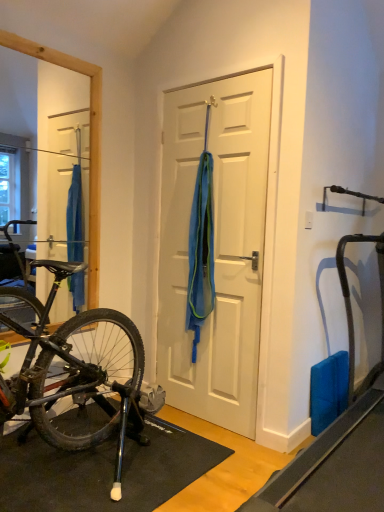
The width and height of the screenshot is (384, 512). I want to click on blue rubber mat at right, so click(339, 438).

How distant is white matte door at center from blue mesh towel at center?

They are 18.45 centimeters apart.

Can you tell me how much white matte door at center and blue mesh towel at center differ in facing direction?

The facing directions of white matte door at center and blue mesh towel at center are 0.000904 degrees apart.

Who is smaller, white matte door at center or blue mesh towel at center?

blue mesh towel at center is smaller.

Based on the photo, would you consider white matte door at center to be distant from blue mesh towel at center?

white matte door at center is actually quite close to blue mesh towel at center.

From the picture: From a real-world perspective, which is physically above, white matte door at center or blue rubber mat at right?

white matte door at center.

Is white matte door at center looking in the opposite direction of blue rubber mat at right?

No, white matte door at center's orientation is not away from blue rubber mat at right.

From the image's perspective, is white matte door at center located beneath blue rubber mat at right?

No, from the image's perspective, white matte door at center is not beneath blue rubber mat at right.

Does white matte door at center have a lesser width compared to blue rubber mat at right?

Correct, the width of white matte door at center is less than that of blue rubber mat at right.

What's the angular difference between blue mesh towel at center and blue rubber mat at right's facing directions?

0.476 degrees separate the facing orientations of blue mesh towel at center and blue rubber mat at right.

Is point (189, 270) closer to camera compared to point (359, 503)?

No, (189, 270) is further to viewer.

Would you say blue mesh towel at center contains blue rubber mat at right?

No.

Does blue mesh towel at center turn towards blue rubber mat at right?

No.

Do you think blue rubber mat at right is within blue mesh towel at center, or outside of it?

blue rubber mat at right is spatially situated outside blue mesh towel at center.

I want to click on towel/napkin that is above the blue rubber mat at right (from the image's perspective), so click(201, 251).

Based on the photo, between blue rubber mat at right and blue mesh towel at center, which one is positioned behind?

blue mesh towel at center is further away from the camera.

From a real-world perspective, which is physically below, blue rubber mat at right or blue mesh towel at center?

From a 3D spatial view, blue rubber mat at right is below.

In terms of height, does blue mesh towel at center look taller or shorter compared to white matte door at center?

In the image, blue mesh towel at center appears to be shorter than white matte door at center.

From the image's perspective, which object appears higher, blue mesh towel at center or white matte door at center?

blue mesh towel at center, from the image's perspective.

Locate an element on the screen. door in front of the blue mesh towel at center is located at coordinates (215, 247).

Which is nearer, (306,449) or (249,382)?

Point (306,449).

Consider the image. Is blue rubber mat at right beside white matte door at center?

blue rubber mat at right is not next to white matte door at center, and they're not touching.

Based on the photo, can you confirm if blue rubber mat at right is thinner than white matte door at center?

Incorrect, the width of blue rubber mat at right is not less than that of white matte door at center.

Is blue rubber mat at right not inside white matte door at center?

blue rubber mat at right is positioned outside white matte door at center.

The height and width of the screenshot is (512, 384). What are the coordinates of `towel/napkin above the white matte door at center (from the image's perspective)` in the screenshot? It's located at (201, 251).

This screenshot has width=384, height=512. Find the location of `treadmill located below the white matte door at center (from the image's perspective)`. treadmill located below the white matte door at center (from the image's perspective) is located at coordinates (339, 438).

Which object lies nearer to the anchor point white matte door at center, blue mesh towel at center or blue rubber mat at right?

blue mesh towel at center is positioned closer to the anchor white matte door at center.

Considering their positions, is white matte door at center positioned further to blue mesh towel at center than blue rubber mat at right?

blue rubber mat at right is further to blue mesh towel at center.

Estimate the real-world distances between objects in this image. Which object is closer to blue rubber mat at right, white matte door at center or blue mesh towel at center?

white matte door at center lies closer to blue rubber mat at right than the other object.

Considering their positions, is blue rubber mat at right positioned closer to blue mesh towel at center than white matte door at center?

white matte door at center is positioned closer to the anchor blue mesh towel at center.

Estimate the real-world distances between objects in this image. Which object is closer to white matte door at center, blue rubber mat at right or blue mesh towel at center?

blue mesh towel at center.

Based on their spatial positions, is blue mesh towel at center or white matte door at center closer to blue rubber mat at right?

white matte door at center is positioned closer to the anchor blue rubber mat at right.

Identify the location of door located between blue rubber mat at right and blue mesh towel at center in the depth direction. The height and width of the screenshot is (512, 384). (215, 247).